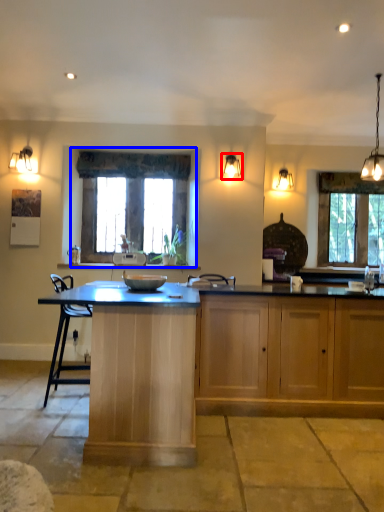
Question: Which of the following is the farthest to the observer, lamp (highlighted by a red box) or window (highlighted by a blue box)?

Choices:
 (A) lamp
 (B) window

Answer: (B)